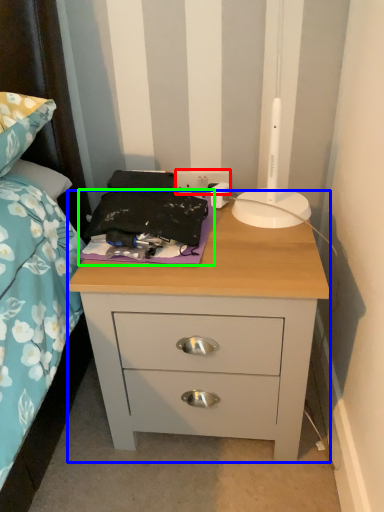
Question: Based on their relative distances, which object is nearer to electric outlet (highlighted by a red box)? Choose from nightstand (highlighted by a blue box) and sheet (highlighted by a green box).

Choices:
 (A) nightstand
 (B) sheet

Answer: (B)